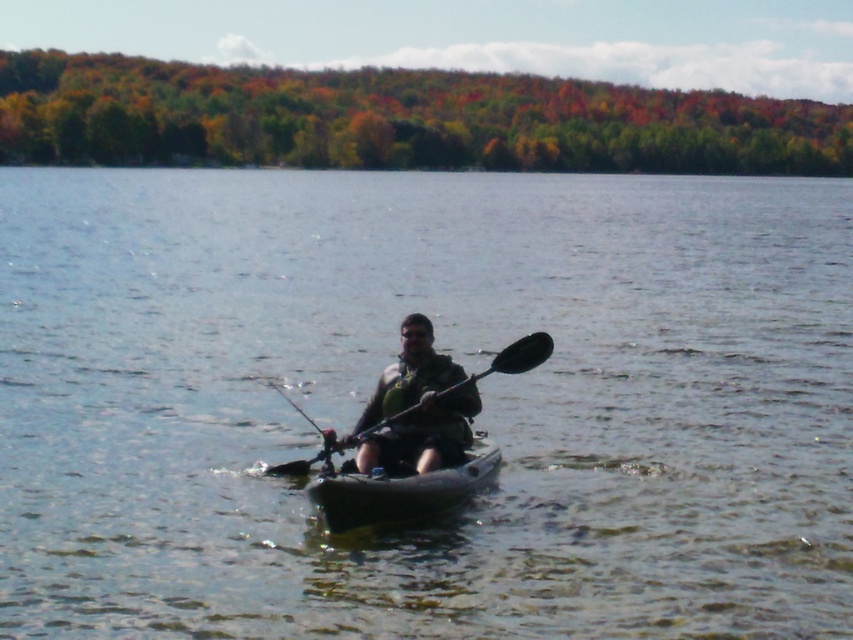
Question: In this image, where is clear water at center located relative to black plastic paddle at center?

Choices:
 (A) above
 (B) below

Answer: (A)

Question: Which point is closer to the camera taking this photo?

Choices:
 (A) (415, 554)
 (B) (355, 493)
 (C) (407, 444)

Answer: (B)

Question: Which point appears closest to the camera in this image?

Choices:
 (A) (424, 332)
 (B) (312, 460)
 (C) (161, 504)

Answer: (A)

Question: Is clear water at center wider than camouflage fabric kayak at center?

Choices:
 (A) no
 (B) yes

Answer: (B)

Question: Observing the image, what is the correct spatial positioning of black plastic canoe at center in reference to black plastic paddle at center?

Choices:
 (A) below
 (B) above

Answer: (A)

Question: Estimate the real-world distances between objects in this image. Which object is closer to the clear water at center?

Choices:
 (A) black plastic paddle at center
 (B) camouflage fabric kayak at center
 (C) black plastic canoe at center

Answer: (B)